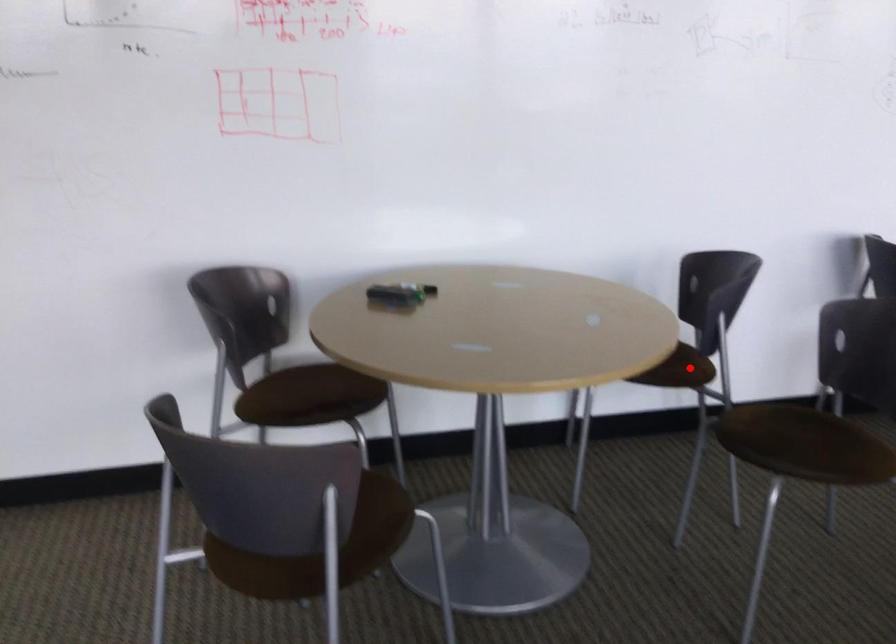
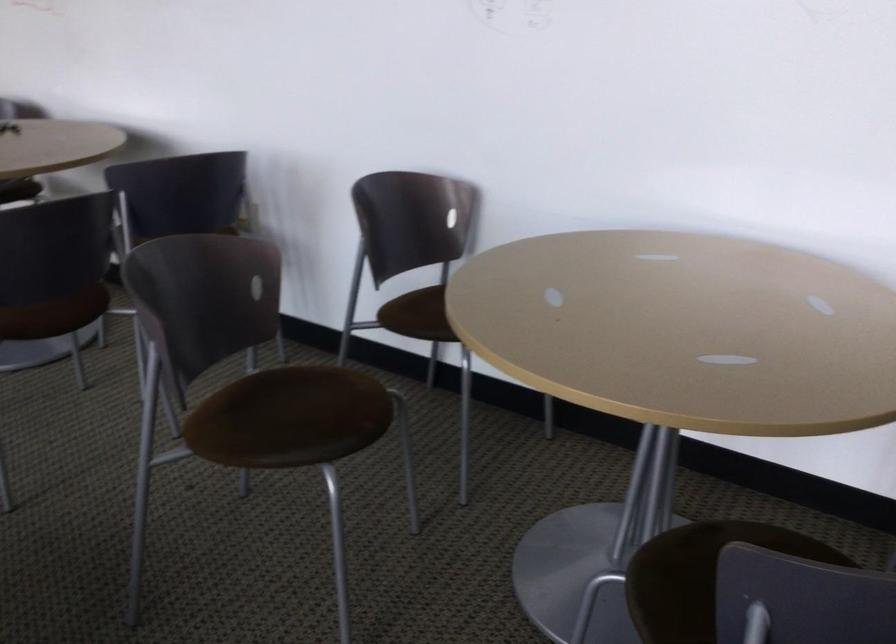
Question: I am providing you with two images of the same scene from different viewpoints. A red point is marked on the first image. At the location where the point appears in image 1, is it still visible in image 2?

Choices:
 (A) Yes
 (B) No

Answer: (B)